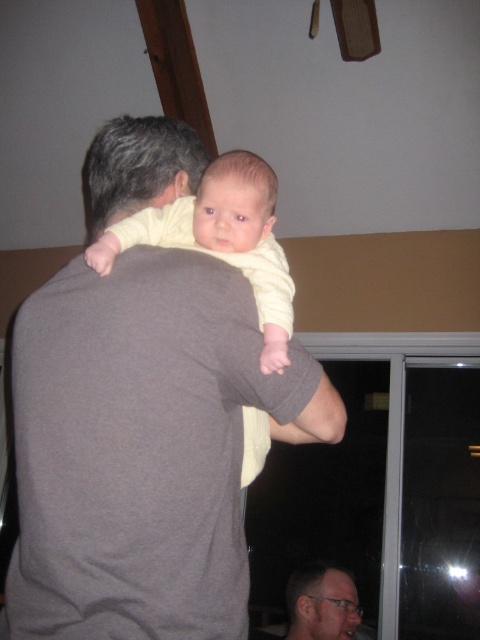
Question: Does gray cotton shirt at upper left appear on the left side of matte gray shirt at center?

Choices:
 (A) no
 (B) yes

Answer: (B)

Question: Based on their relative distances, which object is nearer to the yellow soft fabric baby at center?

Choices:
 (A) matte gray shirt at center
 (B) gray cotton shirt at upper left

Answer: (B)

Question: Considering the relative positions of yellow soft fabric baby at center and matte gray shirt at center in the image provided, where is yellow soft fabric baby at center located with respect to matte gray shirt at center?

Choices:
 (A) below
 (B) above

Answer: (B)

Question: Which point is farther to the camera?

Choices:
 (A) gray cotton shirt at upper left
 (B) yellow soft fabric baby at center

Answer: (B)

Question: Observing the image, what is the correct spatial positioning of gray cotton shirt at upper left in reference to matte gray shirt at center?

Choices:
 (A) below
 (B) above

Answer: (B)

Question: Considering the real-world distances, which object is farthest from the matte gray shirt at center?

Choices:
 (A) gray cotton shirt at upper left
 (B) yellow soft fabric baby at center

Answer: (B)